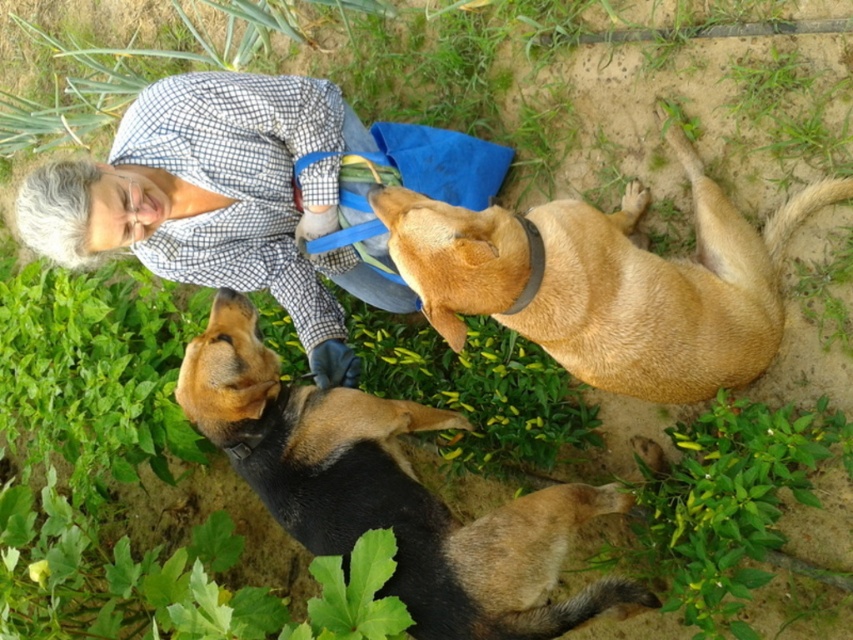
Question: Which point is farther to the camera?

Choices:
 (A) checkered fabric shirt at upper left
 (B) golden fur dog at center

Answer: (A)

Question: Which point is farther to the camera?

Choices:
 (A) black fur dog at lower center
 (B) checkered fabric shirt at upper left

Answer: (B)

Question: Does golden fur dog at center have a greater width compared to black fur dog at lower center?

Choices:
 (A) no
 (B) yes

Answer: (A)

Question: Where is golden fur dog at center located in relation to checkered fabric shirt at upper left in the image?

Choices:
 (A) above
 (B) below

Answer: (A)

Question: Which point appears closest to the camera in this image?

Choices:
 (A) (589, 342)
 (B) (320, 356)

Answer: (A)

Question: Where is golden fur dog at center located in relation to checkered fabric shirt at upper left in the image?

Choices:
 (A) right
 (B) left

Answer: (A)